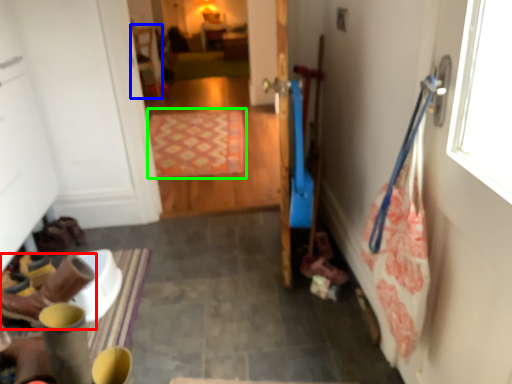
Question: Which object is positioned farthest from footwear (highlighted by a red box)? Select from chair (highlighted by a blue box) and mat (highlighted by a green box).

Choices:
 (A) chair
 (B) mat

Answer: (A)